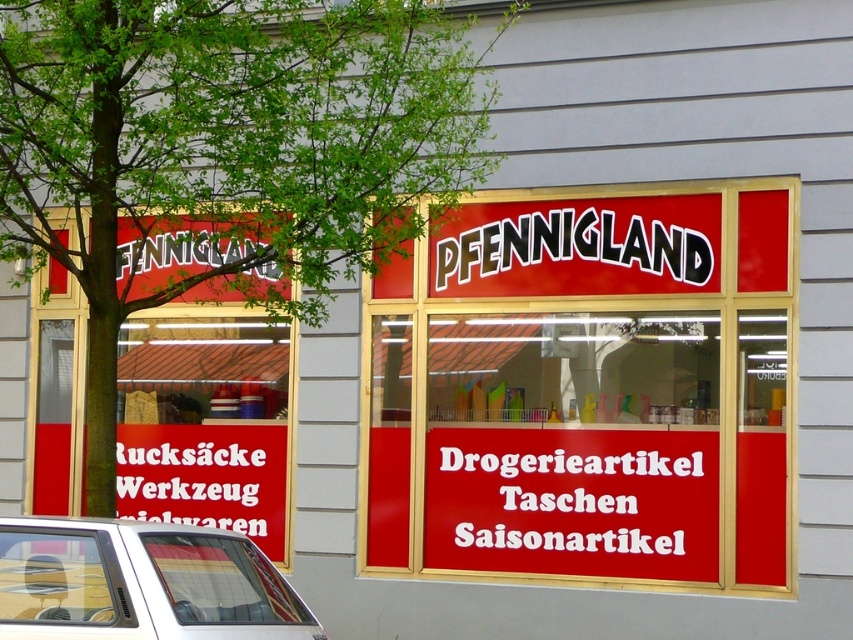
Consider the image. Between matte red signboard at center and white matte car at lower left, which one appears on the left side from the viewer's perspective?

From the viewer's perspective, white matte car at lower left appears more on the left side.

Who is taller, matte red signboard at center or white matte car at lower left?

Standing taller between the two is matte red signboard at center.

This screenshot has height=640, width=853. Describe the element at coordinates (589, 392) in the screenshot. I see `matte red signboard at center` at that location.

You are a GUI agent. You are given a task and a screenshot of the screen. Output one action in this format:
    pyautogui.click(x=<x>, y=<y>)
    Task: Click on the matte red signboard at center
    This screenshot has width=853, height=640.
    Given the screenshot: What is the action you would take?
    pyautogui.click(x=589, y=392)

Between matte red signboard at center and red matte signboard at left, which one is positioned lower?

red matte signboard at left is below.

Does matte red signboard at center appear under red matte signboard at left?

Actually, matte red signboard at center is above red matte signboard at left.

Locate an element on the screen. matte red signboard at center is located at coordinates (589, 392).

From the picture: Is green leafy tree at upper left thinner than white matte car at lower left?

No.

Does green leafy tree at upper left have a lesser height compared to white matte car at lower left?

In fact, green leafy tree at upper left may be taller than white matte car at lower left.

Does point (4, 176) come closer to viewer compared to point (7, 556)?

No, (4, 176) is further to viewer.

At what (x,y) coordinates should I click in order to perform the action: click on green leafy tree at upper left. Please return your answer as a coordinate pair (x, y). This screenshot has width=853, height=640. Looking at the image, I should click on (225, 154).